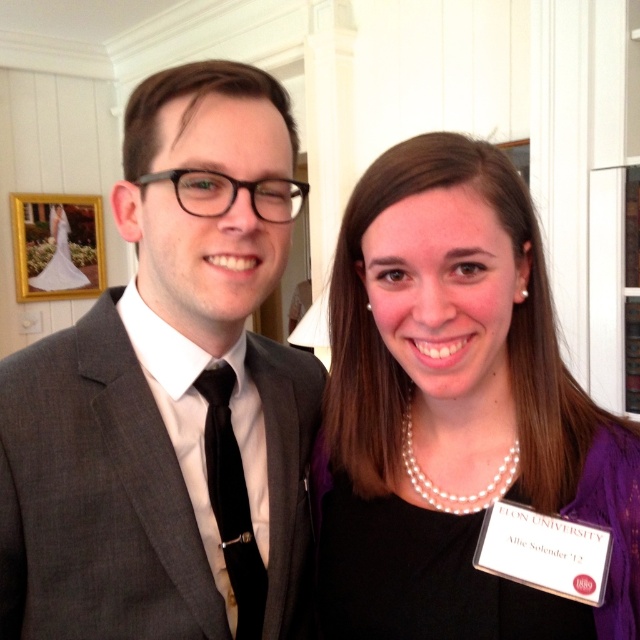
Question: Is pearl necklace at center behind black silk tie at left?

Choices:
 (A) yes
 (B) no

Answer: (B)

Question: Estimate the real-world distances between objects in this image. Which object is farther from the black silk tie at left?

Choices:
 (A) gold-framed picture at upper left
 (B) matte gray suit at left

Answer: (A)

Question: In this image, where is matte gray suit at left located relative to pearl necklace at center?

Choices:
 (A) left
 (B) right

Answer: (A)

Question: Which object is the closest to the white satin dress at upper left?

Choices:
 (A) black silk tie at left
 (B) gold-framed picture at upper left
 (C) matte gray suit at left

Answer: (B)

Question: Is black silk tie at left below white satin dress at upper left?

Choices:
 (A) no
 (B) yes

Answer: (B)

Question: Which of the following is the closest to the observer?

Choices:
 (A) pearl necklace at center
 (B) matte gray suit at left
 (C) gold-framed picture at upper left
 (D) black silk tie at left

Answer: (A)